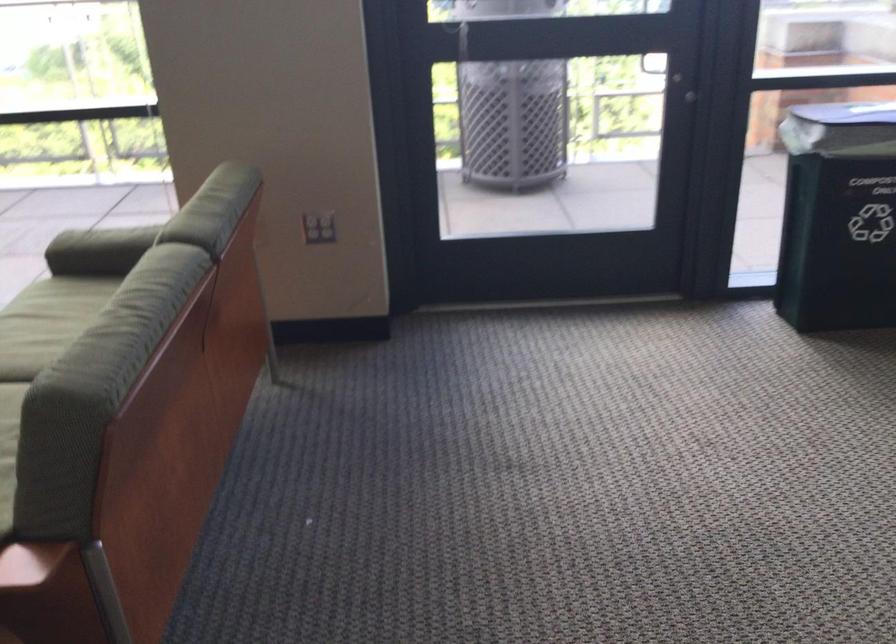
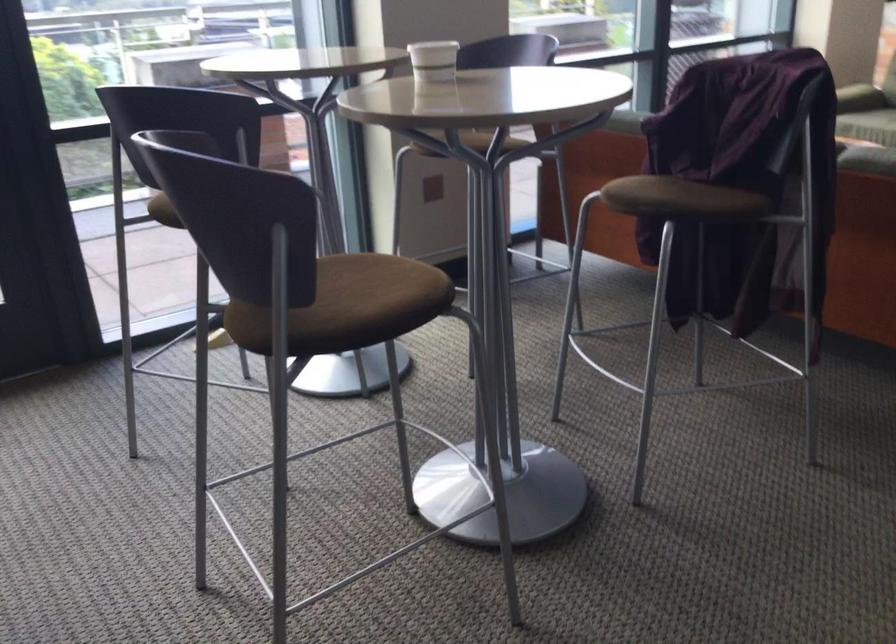
Question: I am providing you with two images of the same scene from different viewpoints. After the viewpoint changes to image2, which objects are now occluded?

Choices:
 (A) silver mailbox door
 (B) power outlet socket
 (C) white paper cup
 (D) brown chair sitting surface

Answer: (B)